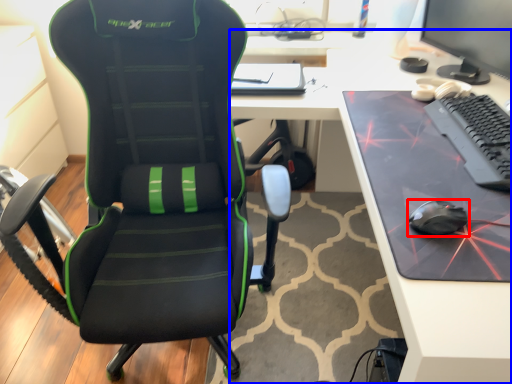
Question: Which object is further to the camera taking this photo, mouse (highlighted by a red box) or desk (highlighted by a blue box)?

Choices:
 (A) mouse
 (B) desk

Answer: (A)